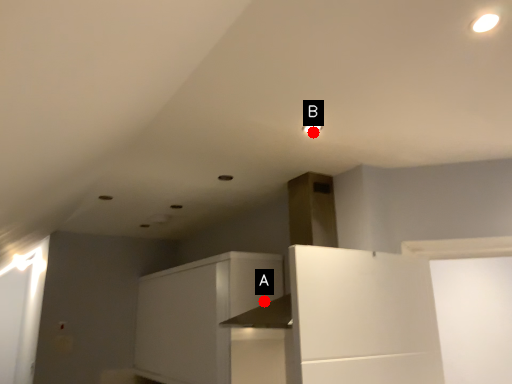
Question: Two points are circled on the image, labeled by A and B beside each circle. Which point is closer to the camera taking this photo?

Choices:
 (A) A is closer
 (B) B is closer

Answer: (B)